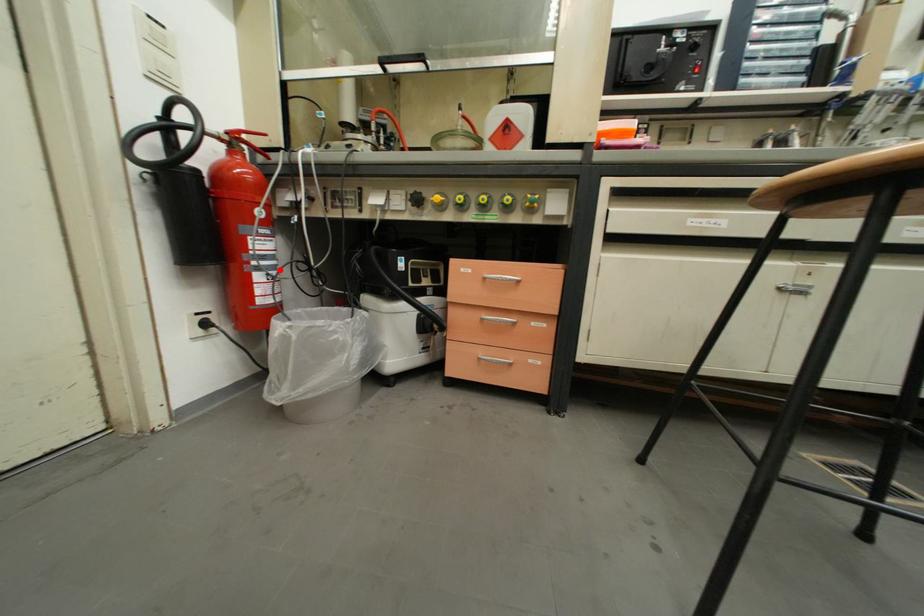
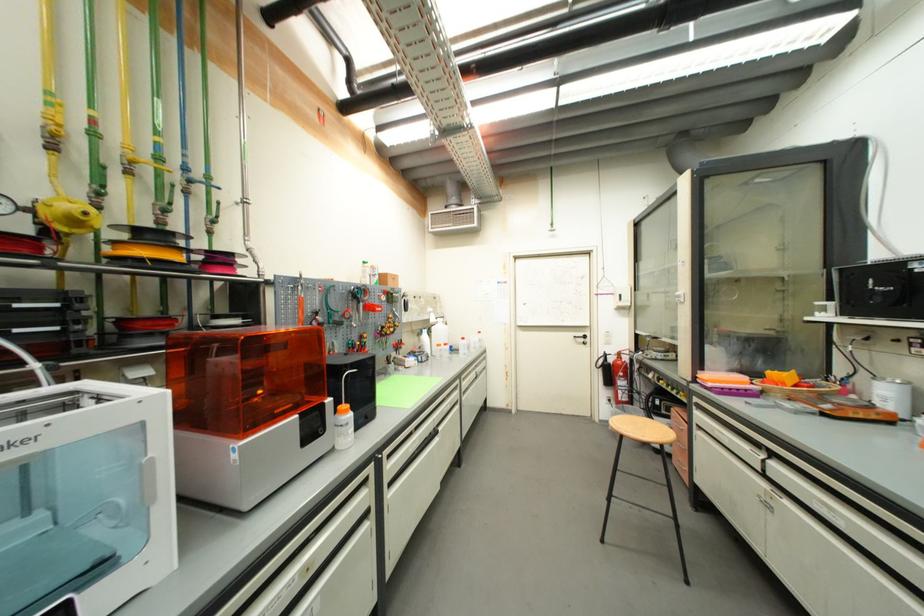
The point at the highlighted location is marked in the first image. Where is the corresponding point in the second image?

(630, 391)